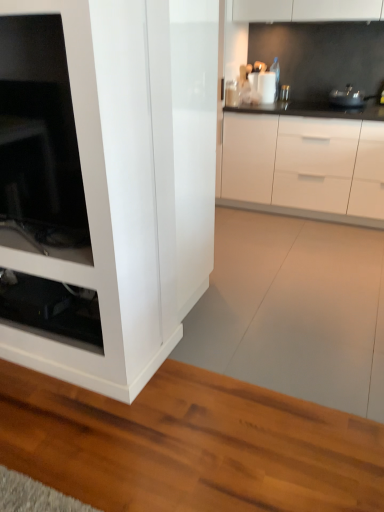
Question: Is white glossy container at upper center, marked as the first appliance in a left-to-right arrangement, thinner than white glossy cabinet at center?

Choices:
 (A) no
 (B) yes

Answer: (B)

Question: Does white glossy container at upper center, arranged as the 2th appliance when viewed from the right, have a smaller size compared to white glossy cabinet at center?

Choices:
 (A) yes
 (B) no

Answer: (A)

Question: From the image's perspective, does white glossy container at upper center, marked as the first appliance in a left-to-right arrangement, appear lower than white glossy cabinet at center?

Choices:
 (A) yes
 (B) no

Answer: (B)

Question: Can you confirm if white glossy container at upper center, marked as the first appliance in a left-to-right arrangement, is taller than white glossy cabinet at center?

Choices:
 (A) yes
 (B) no

Answer: (B)

Question: Considering the relative positions of white glossy container at upper center, marked as the first appliance in a left-to-right arrangement, and white glossy cabinet at center in the image provided, is white glossy container at upper center, marked as the first appliance in a left-to-right arrangement, behind white glossy cabinet at center?

Choices:
 (A) no
 (B) yes

Answer: (B)

Question: From a real-world perspective, is metallic silver pot at upper right, which is the 2th appliance in left-to-right order, above or below transparent glass shelf at lower left?

Choices:
 (A) above
 (B) below

Answer: (A)

Question: Is metallic silver pot at upper right, which is the 2th appliance in left-to-right order, bigger or smaller than transparent glass shelf at lower left?

Choices:
 (A) small
 (B) big

Answer: (B)

Question: Considering the positions of metallic silver pot at upper right, the 1th appliance viewed from the right, and transparent glass shelf at lower left in the image, is metallic silver pot at upper right, the 1th appliance viewed from the right, wider or thinner than transparent glass shelf at lower left?

Choices:
 (A) wide
 (B) thin

Answer: (A)

Question: Is metallic silver pot at upper right, which is the 2th appliance in left-to-right order, inside the boundaries of transparent glass shelf at lower left, or outside?

Choices:
 (A) inside
 (B) outside

Answer: (B)

Question: Is white glossy container at upper center, marked as the first appliance in a left-to-right arrangement, wider or thinner than metallic silver pot at upper right, which is the 2th appliance in left-to-right order?

Choices:
 (A) wide
 (B) thin

Answer: (B)

Question: Is white glossy container at upper center, arranged as the 2th appliance when viewed from the right, inside the boundaries of metallic silver pot at upper right, the 1th appliance viewed from the right, or outside?

Choices:
 (A) inside
 (B) outside

Answer: (B)

Question: From a real-world perspective, relative to metallic silver pot at upper right, which is the 2th appliance in left-to-right order, is white glossy container at upper center, arranged as the 2th appliance when viewed from the right, vertically above or below?

Choices:
 (A) above
 (B) below

Answer: (A)

Question: Considering the positions of white glossy container at upper center, arranged as the 2th appliance when viewed from the right, and metallic silver pot at upper right, the 1th appliance viewed from the right, in the image, is white glossy container at upper center, arranged as the 2th appliance when viewed from the right, taller or shorter than metallic silver pot at upper right, the 1th appliance viewed from the right,?

Choices:
 (A) short
 (B) tall

Answer: (B)

Question: Which is correct: transparent glass shelf at lower left is inside metallic silver pot at upper right, which is the 2th appliance in left-to-right order, or outside of it?

Choices:
 (A) outside
 (B) inside

Answer: (A)

Question: In terms of height, does transparent glass shelf at lower left look taller or shorter compared to metallic silver pot at upper right, the 1th appliance viewed from the right?

Choices:
 (A) tall
 (B) short

Answer: (B)